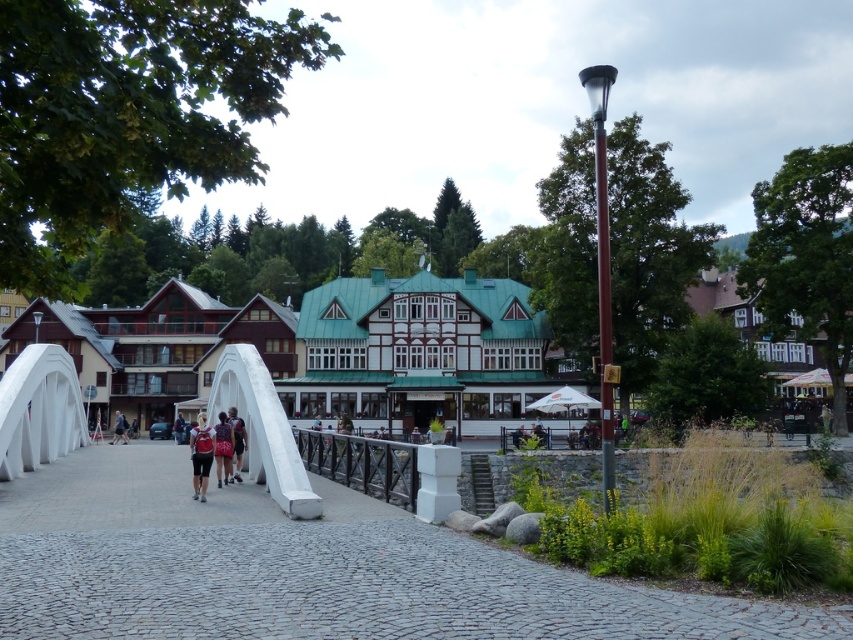
You are a tourist in the town square and see two backpacks, the red fabric backpack at center and the dark blue backpack at center. Which backpack is taller?

The red fabric backpack at center is taller than the dark blue backpack at center.

You are standing at the town square and want to take a photo of the quaint multi story building with green roof and white framed windows. The camera you are using has a maximum focus range of 80 meters. Is the point at coordinates point (190, 445) within the camera focus range?

The distance of point (190, 445) from camera is 81.60 meters, which is beyond the camera focus range of 80 meters. Therefore, the point is out of focus range.